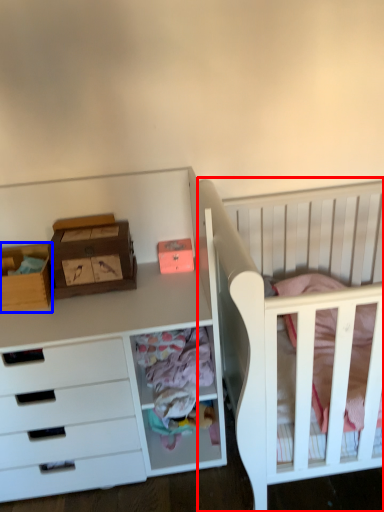
Question: Among these objects, which one is farthest to the camera, infant bed (highlighted by a red box) or storage box (highlighted by a blue box)?

Choices:
 (A) infant bed
 (B) storage box

Answer: (B)